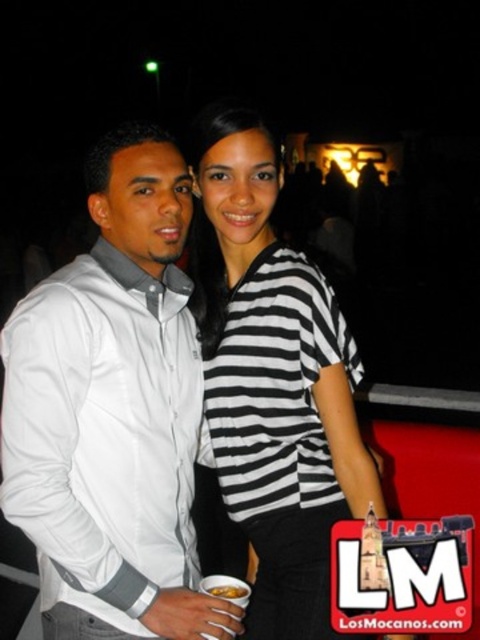
You are a photographer at this event. You want to ensure both the white matte shirt at center and the black and white striped shirt at center are clearly visible in your photo. Based on their positions, which shirt is more likely to be in focus if you focus on the center of the image?

The white matte shirt at center is more likely to be in focus because it is positioned at the center of the image where focus is typically centered.

You are at a party and want to take a photo of the two people wearing the white matte shirt at center and the black and white striped shirt at center. If you stand directly in front of them, which direction should you move to frame both of them properly in your camera viewfinder?

Since the white matte shirt at center is positioned on the left side of the black and white striped shirt at center, you should move to the right slightly to ensure both the white matte shirt at center and the black and white striped shirt at center are fully visible in the frame.

You are standing in a dark outdoor area at night. You see a point at coordinate point (120, 611). Can you reach it without moving your feet?

The point at coordinate point (120, 611) is 1.55 meters away from you, so you can reach it without moving your feet if your arm length is at least 1.55 meters. However, typical human arm length is shorter than that, so it might be difficult to reach without moving.